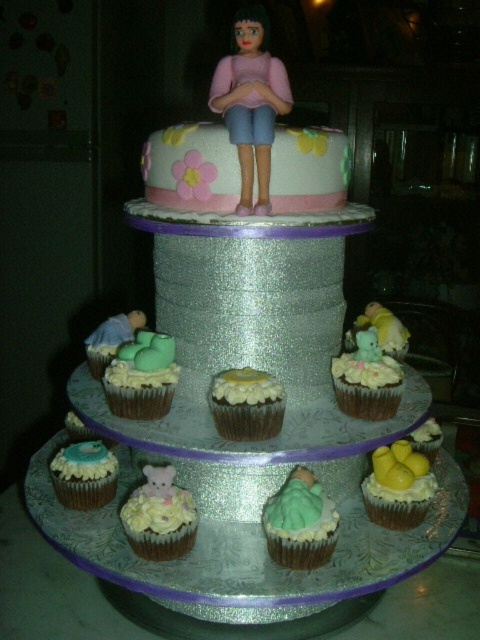
Question: Which point is closer to the camera?

Choices:
 (A) pink matte plastic doll at center
 (B) matte yellow frosting at center
 (C) green frosting cupcake at center
 (D) matte green frosting at center

Answer: (C)

Question: Which point is closer to the camera?

Choices:
 (A) matte green frosting at center
 (B) blue frosted cupcake at lower left

Answer: (A)

Question: Is green frosting cupcake at center further to camera compared to white frosting cupcake at center?

Choices:
 (A) yes
 (B) no

Answer: (B)

Question: Among these objects, which one is nearest to the camera?

Choices:
 (A) matte yellow frosting at center
 (B) matte green frosting at center
 (C) green frosting cupcake at center
 (D) yellow frosting cupcake at lower right

Answer: (C)

Question: Where is yellow frosting at bottom right located in relation to yellow frosting cupcake at lower right in the image?

Choices:
 (A) right
 (B) left

Answer: (B)

Question: Is pink matte plastic doll at center to the right of blue frosted cupcake at lower left from the viewer's perspective?

Choices:
 (A) yes
 (B) no

Answer: (A)